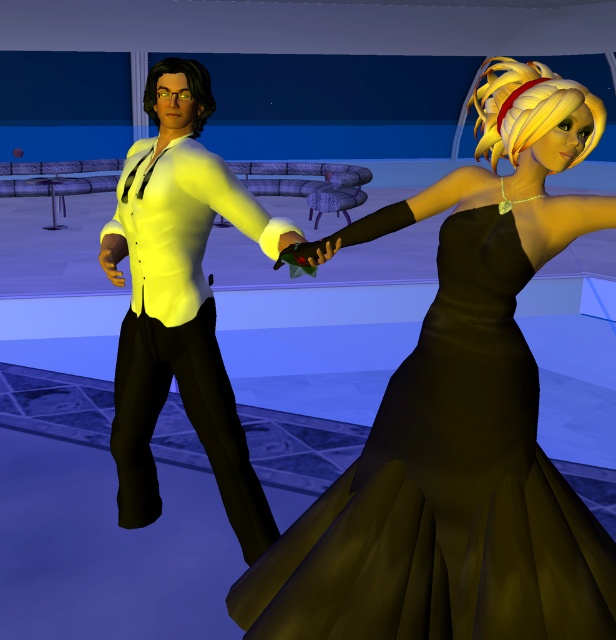
Is black satin dress at center below matte yellow shirt at center?

Correct, black satin dress at center is located below matte yellow shirt at center.

Is point (505, 268) positioned after point (179, 352)?

No, it is not.

Is point (426, 492) closer to viewer compared to point (161, 128)?

Yes, point (426, 492) is closer to viewer.

Find the location of a particular element. The image size is (616, 640). black satin dress at center is located at coordinates (445, 490).